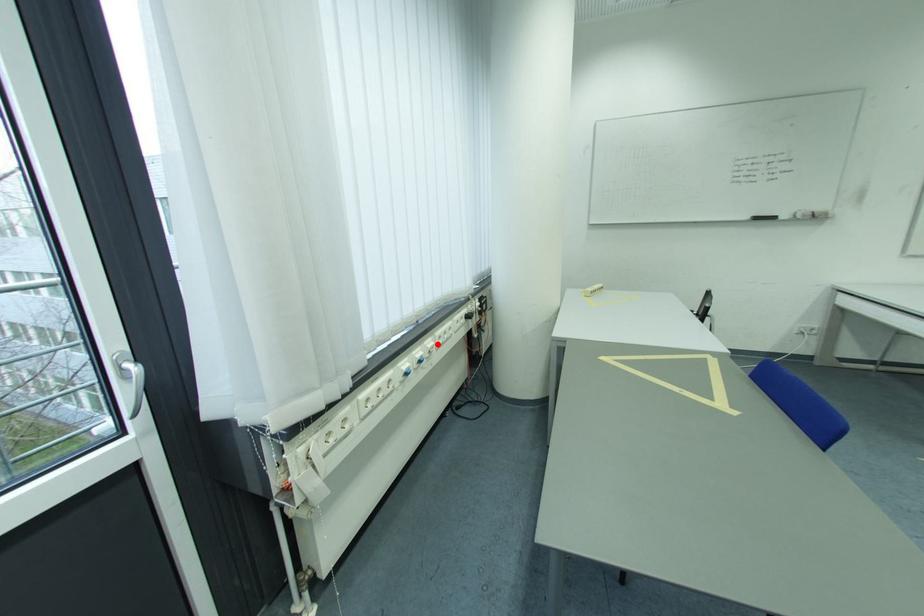
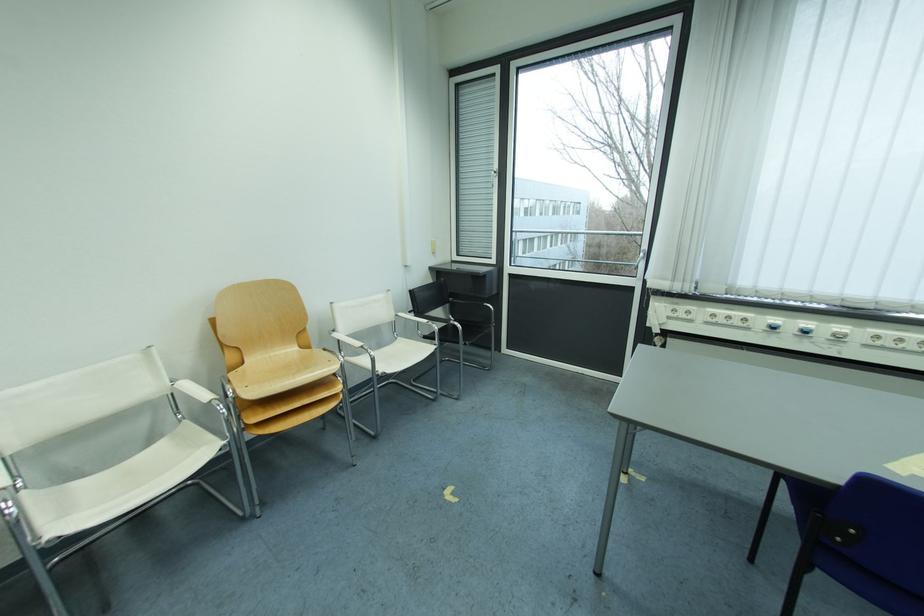
Find the pixel in the second image that matches the highlighted location in the first image.

(849, 330)